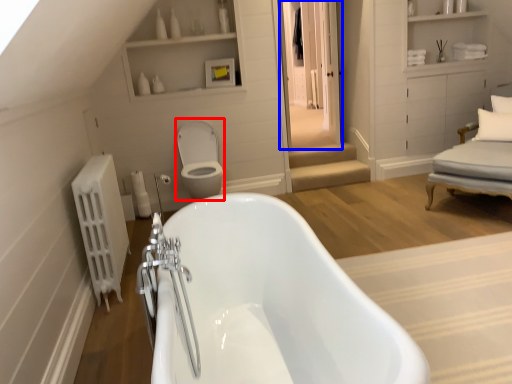
Question: Which object is further to the camera taking this photo, toilet bowl (highlighted by a red box) or glass door (highlighted by a blue box)?

Choices:
 (A) toilet bowl
 (B) glass door

Answer: (B)